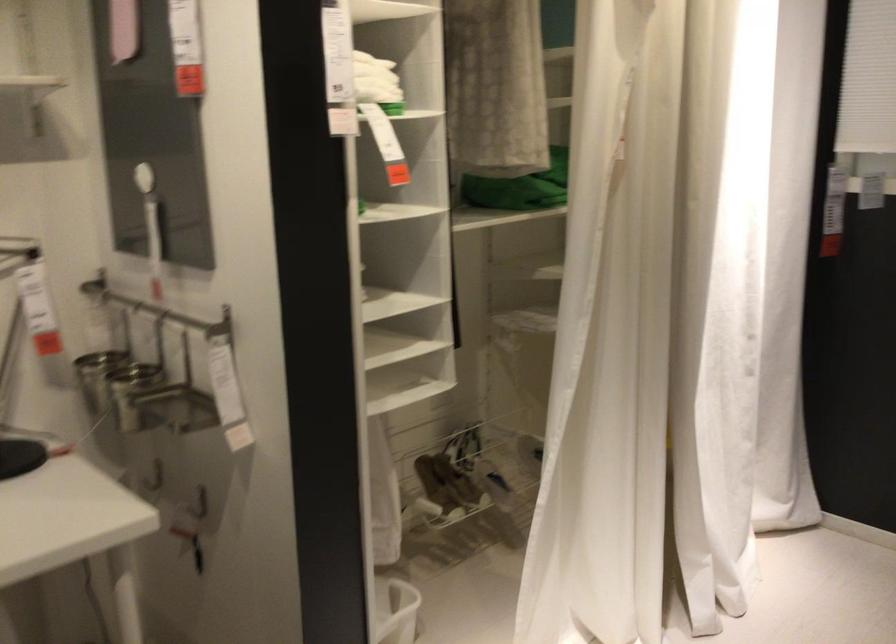
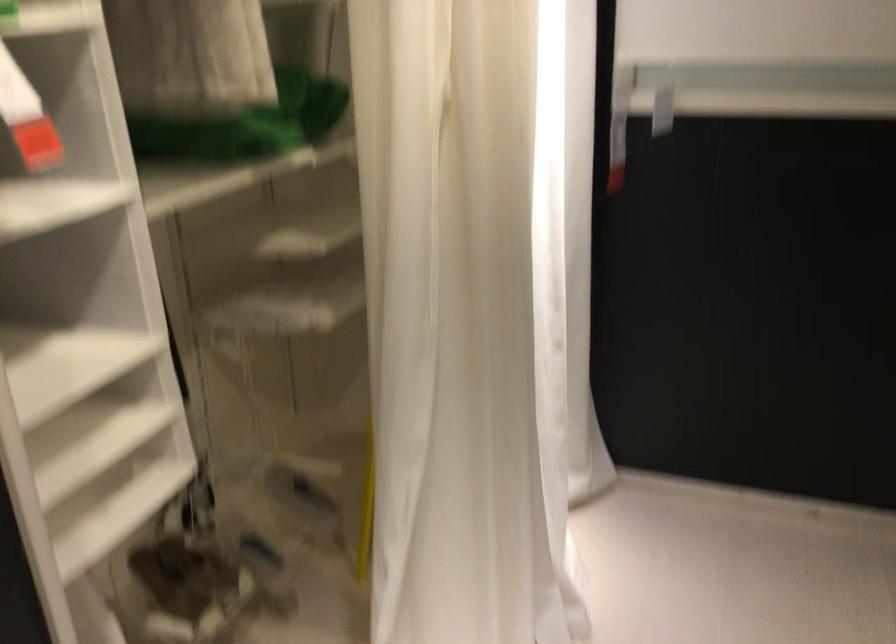
Question: The first image is from the beginning of the video and the second image is from the end. How did the camera likely rotate when shooting the video?

Choices:
 (A) Left
 (B) Right
 (C) Up
 (D) Down

Answer: (B)